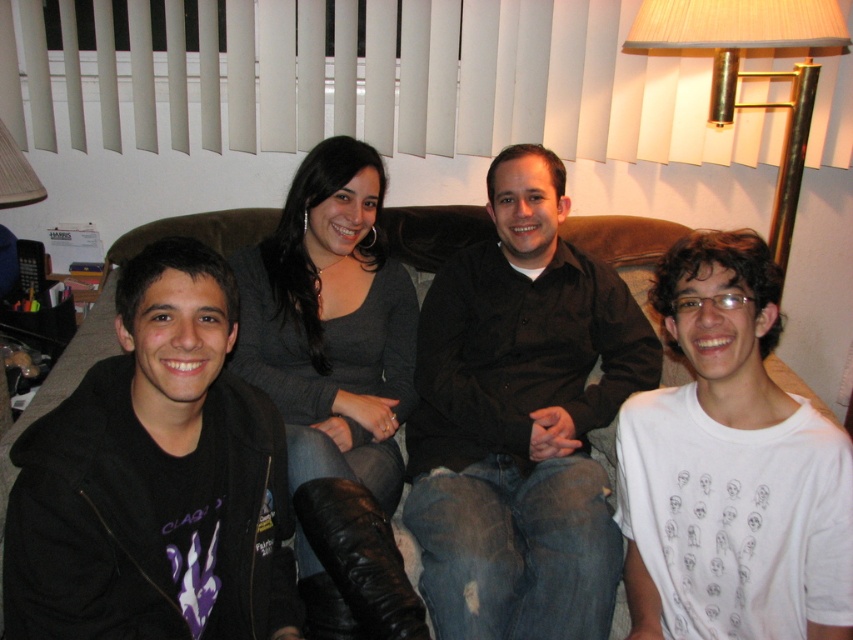
Question: Considering the real-world distances, which object is closest to the brown fabric couch at center?

Choices:
 (A) gray sweater at center
 (B) gold metallic lampshade at upper right

Answer: (A)

Question: Which point appears closest to the camera in this image?

Choices:
 (A) (799, 74)
 (B) (79, 346)
 (C) (271, 470)

Answer: (C)

Question: Which of the following is the closest to the observer?

Choices:
 (A) black matte shirt at center
 (B) black fleece jacket at lower left
 (C) brown fabric couch at center

Answer: (B)

Question: Can you confirm if white printed t-shirt at center is bigger than gray sweater at center?

Choices:
 (A) yes
 (B) no

Answer: (B)

Question: Does black matte shirt at center appear under black fleece jacket at lower left?

Choices:
 (A) no
 (B) yes

Answer: (A)

Question: Is white printed t-shirt at center bigger than gold metallic lampshade at upper right?

Choices:
 (A) no
 (B) yes

Answer: (A)